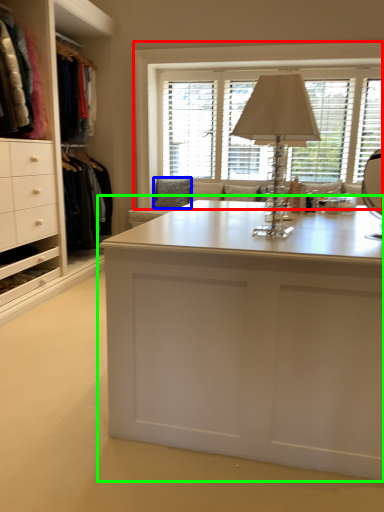
Question: Estimate the real-world distances between objects in this image. Which object is farther from window (highlighted by a red box), pillow (highlighted by a blue box) or desk (highlighted by a green box)?

Choices:
 (A) pillow
 (B) desk

Answer: (B)